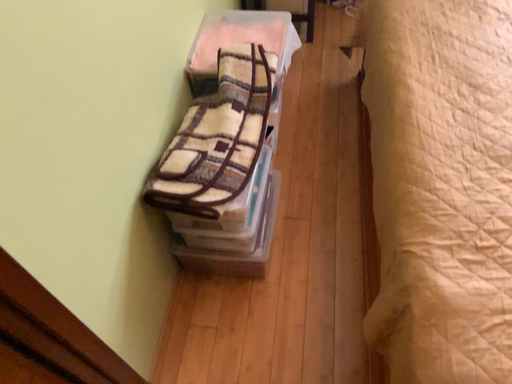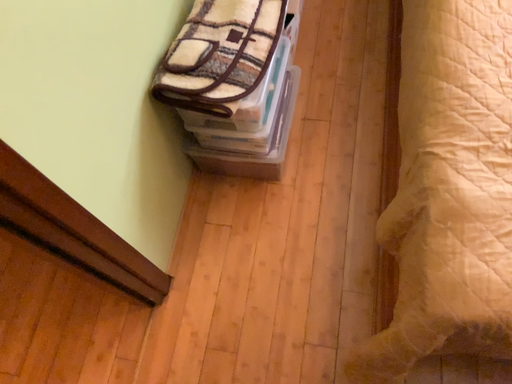
Question: Which way did the camera rotate in the video?

Choices:
 (A) rotated downward
 (B) rotated upward

Answer: (A)